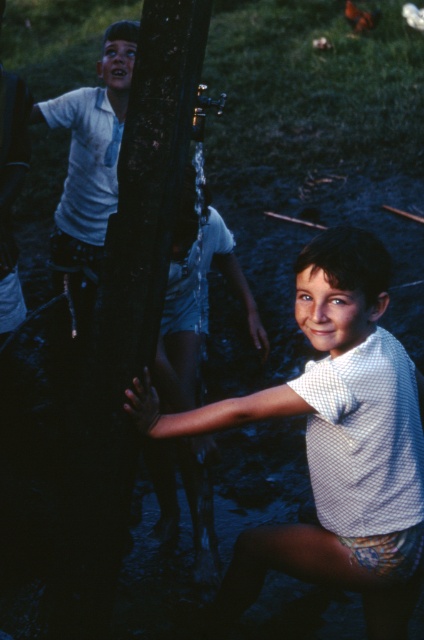
You are standing at the camera position and want to throw a ball to a friend who is at point (x=95, y=214). There is an obstacle at point (x=387, y=259). Will the obstacle block your throw to the friend?

Point (x=387, y=259) is closer to the camera than point (x=95, y=214), so the obstacle at point (x=387, y=259) will block your throw to the friend at point (x=95, y=214).

You are standing in the scene and want to locate the white dotted shirt at center. Based on the coordinates provided, where would you look relative to the tree trunk?

The white dotted shirt at center is located at coordinates point (314, 440), which is to the right and slightly above the tree trunk in the foreground.

You are organizing a clothing donation drive and need to determine which shirt can fit into a standard donation box that accommodates items up to 1 meter in width. Based on the scene description, can both the white dotted shirt at center and the white cotton shirt at upper left fit into the box?

The white dotted shirt at center might be wider than white cotton shirt at upper left, but since the maximum width of the donation box is 1 meter, both shirts would likely fit as clothing items typically do not exceed that width unless they are oversized. However, there is uncertainty about the exact width of the white dotted shirt at center.